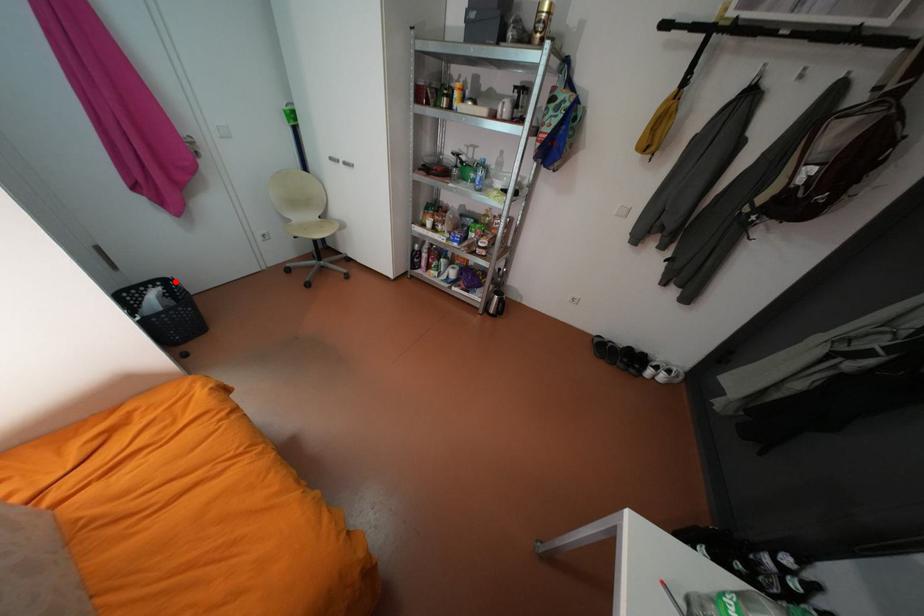
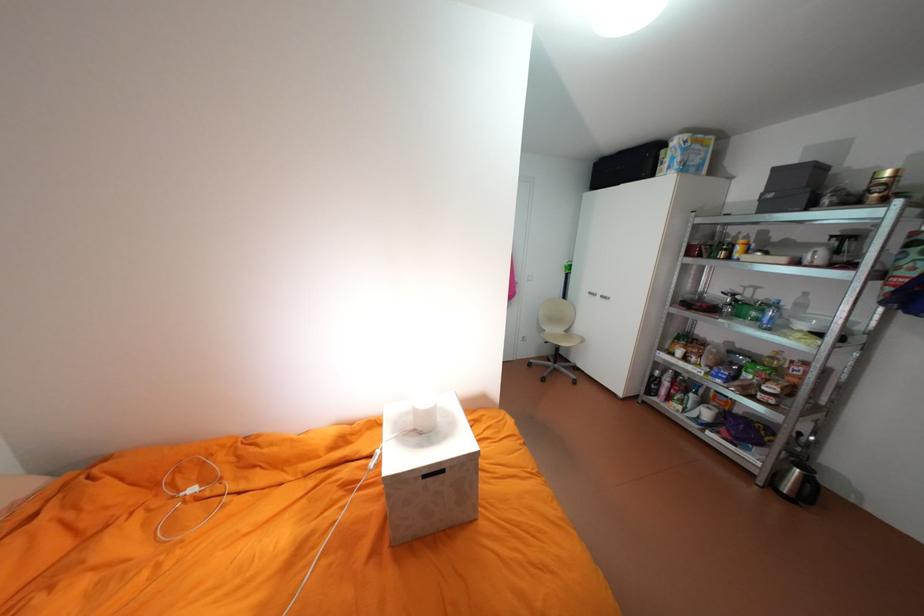
Question: I am providing you with two images of the same scene from different viewpoints. A red point is marked on the first image. Is the red point's position out of view in image 2?

Choices:
 (A) Yes
 (B) No

Answer: (A)